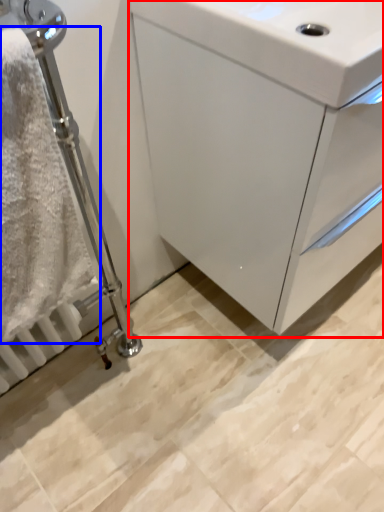
Question: Which point is closer to the camera, bathroom cabinet (highlighted by a red box) or bath towel (highlighted by a blue box)?

Choices:
 (A) bathroom cabinet
 (B) bath towel

Answer: (B)